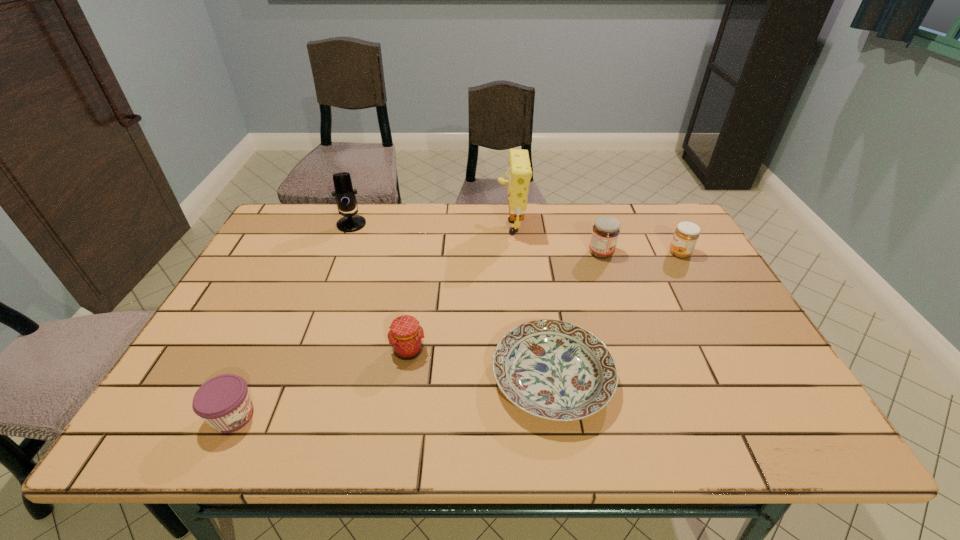
Where is `vacant region between the third jam from right to left and the rightmost jam`? The width and height of the screenshot is (960, 540). vacant region between the third jam from right to left and the rightmost jam is located at coordinates (544, 302).

Locate an element on the screen. object that stands as the closest to the leftmost jam is located at coordinates (406, 336).

This screenshot has width=960, height=540. What are the coordinates of `the fourth closest object to the tallest object` in the screenshot? It's located at (344, 194).

The height and width of the screenshot is (540, 960). I want to click on jam object that ranks as the third closest to the third object from left to right, so click(x=685, y=237).

Identify the location of the third closest jam to the second tallest object. (605, 232).

Locate an element on the screen. vacant space that satisfies the following two spatial constraints: 1. on the face of the tallest object; 2. on the back side of the shortest object is located at coordinates (524, 378).

This screenshot has width=960, height=540. I want to click on vacant space that satisfies the following two spatial constraints: 1. on the stand of the microphone; 2. on the left side of the plate, so click(x=292, y=378).

Image resolution: width=960 pixels, height=540 pixels. I want to click on free space that satisfies the following two spatial constraints: 1. on the face of the tallest object; 2. on the left side of the shortest object, so click(x=524, y=378).

I want to click on free location that satisfies the following two spatial constraints: 1. on the face of the tallest object; 2. on the back side of the shortest object, so click(524, 378).

Identify the location of vacant space that satisfies the following two spatial constraints: 1. on the stand of the third object from left to right; 2. on the right side of the sixth shortest object. Image resolution: width=960 pixels, height=540 pixels. (302, 350).